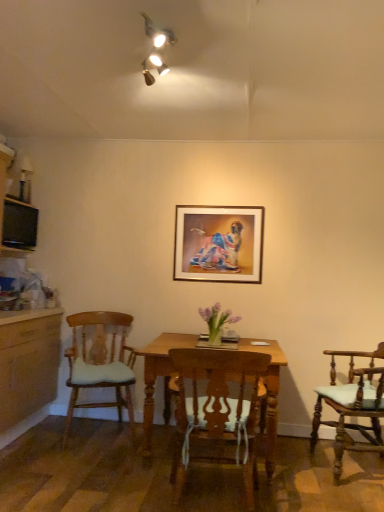
How much space does wooden chair with cushion at right, acting as the third chair starting from the left, occupy horizontally?

It is 58.50 centimeters.

Identify the location of wooden chair with cushion at right, acting as the third chair starting from the left. This screenshot has width=384, height=512. pyautogui.click(x=352, y=405).

Is black glossy television at left a part of wooden chair with cushion at left, placed as the 1th chair when sorted from left to right?

No, black glossy television at left is located outside of wooden chair with cushion at left, placed as the 1th chair when sorted from left to right.

Which object is closer to the camera, wooden chair with cushion at left, placed as the 1th chair when sorted from left to right, or black glossy television at left?

wooden chair with cushion at left, placed as the 1th chair when sorted from left to right, is in front.

Considering the sizes of objects wooden chair with cushion at left, placed as the 1th chair when sorted from left to right, and black glossy television at left in the image provided, who is thinner, wooden chair with cushion at left, placed as the 1th chair when sorted from left to right, or black glossy television at left?

With smaller width is black glossy television at left.

How far apart are wooden chair with cushion at left, arranged as the third chair when viewed from the right, and black glossy television at left?

wooden chair with cushion at left, arranged as the third chair when viewed from the right, is 1.07 meters away from black glossy television at left.

From their relative heights in the image, would you say wooden chair at center, the second chair from the left, is taller or shorter than wooden chair with cushion at left, arranged as the third chair when viewed from the right?

In the image, wooden chair at center, the second chair from the left, appears to be shorter than wooden chair with cushion at left, arranged as the third chair when viewed from the right.

Considering the positions of point (242, 461) and point (110, 353), is point (242, 461) closer or farther from the camera than point (110, 353)?

Point (242, 461).

Who is bigger, wooden chair at center, the second chair from the left, or wooden chair with cushion at left, placed as the 1th chair when sorted from left to right?

wooden chair with cushion at left, placed as the 1th chair when sorted from left to right, is bigger.

From the image's perspective, which object appears higher, wooden chair at center, the second chair from the left, or wooden chair with cushion at left, arranged as the third chair when viewed from the right?

From the image's view, wooden chair with cushion at left, arranged as the third chair when viewed from the right, is above.

Does gold-framed picture at center have a lesser height compared to black glossy television at left?

No, gold-framed picture at center is not shorter than black glossy television at left.

Where is `picture frame located on the right of black glossy television at left`? picture frame located on the right of black glossy television at left is located at coordinates (218, 244).

Which is in front, point (234, 210) or point (25, 230)?

The point (234, 210) is closer to the camera.

Is wooden chair at center, positioned as the second chair in right-to-left order, beside black glossy television at left?

There is a gap between wooden chair at center, positioned as the second chair in right-to-left order, and black glossy television at left.

From the image's perspective, is wooden chair at center, the second chair from the left, on black glossy television at left?

No.

Is wooden chair at center, the second chair from the left, outside of black glossy television at left?

Yes, wooden chair at center, the second chair from the left, is outside of black glossy television at left.

Which object is positioned more to the right, wooden chair with cushion at left, arranged as the third chair when viewed from the right, or wooden chair at center, positioned as the second chair in right-to-left order?

wooden chair at center, positioned as the second chair in right-to-left order, is more to the right.

Can you confirm if wooden chair with cushion at left, arranged as the third chair when viewed from the right, is taller than wooden chair at center, positioned as the second chair in right-to-left order?

Correct, wooden chair with cushion at left, arranged as the third chair when viewed from the right, is much taller as wooden chair at center, positioned as the second chair in right-to-left order.

In the scene shown: Which object is further away from the camera, wooden chair with cushion at left, placed as the 1th chair when sorted from left to right, or wooden chair at center, positioned as the second chair in right-to-left order?

wooden chair with cushion at left, placed as the 1th chair when sorted from left to right, is behind.

Is wooden chair at center, positioned as the second chair in right-to-left order, located within wooden chair with cushion at left, arranged as the third chair when viewed from the right?

Definitely not — wooden chair at center, positioned as the second chair in right-to-left order, is not inside wooden chair with cushion at left, arranged as the third chair when viewed from the right.

Looking at this image, considering the sizes of gold-framed picture at center and wooden chair at center, the second chair from the left, in the image, is gold-framed picture at center wider or thinner than wooden chair at center, the second chair from the left,?

Clearly, gold-framed picture at center has less width compared to wooden chair at center, the second chair from the left.

Is gold-framed picture at center oriented towards wooden chair at center, the second chair from the left?

No.

Is the surface of gold-framed picture at center in direct contact with wooden chair at center, positioned as the second chair in right-to-left order?

No, gold-framed picture at center is not with wooden chair at center, positioned as the second chair in right-to-left order.

Between gold-framed picture at center and wooden chair at center, the second chair from the left, which one is positioned in front?

Positioned in front is wooden chair at center, the second chair from the left.

Could wooden chair with cushion at right, acting as the third chair starting from the left, be considered to be inside wooden chair at center, positioned as the second chair in right-to-left order?

No.

Is wooden chair at center, positioned as the second chair in right-to-left order, turned away from wooden chair with cushion at right, which is the 1th chair from right to left?

No.

Looking at this image, from a real-world perspective, which object rests below the other?

wooden chair with cushion at right, which is the 1th chair from right to left, from a real-world perspective.

From a real-world perspective, starting from the wooden chair with cushion at right, which is the 1th chair from right to left, which chair is the 1st one vertically above it? Please provide its 2D coordinates.

[(218, 409)]

From the image's perspective, starting from the black glossy television at left, which chair is the 1st one below? Please provide its 2D coordinates.

[(100, 362)]

Where is `chair above the wooden chair at center, positioned as the second chair in right-to-left order (from the image's perspective)`? This screenshot has height=512, width=384. chair above the wooden chair at center, positioned as the second chair in right-to-left order (from the image's perspective) is located at coordinates (100, 362).

Based on the photo, from the image, which object appears to be farther from wooden chair at center, positioned as the second chair in right-to-left order, black glossy television at left or wooden chair with cushion at left, placed as the 1th chair when sorted from left to right?

black glossy television at left.

When comparing their distances from wooden chair with cushion at right, which is the 1th chair from right to left, does wooden chair at center, the second chair from the left, or gold-framed picture at center seem closer?

wooden chair at center, the second chair from the left, lies closer to wooden chair with cushion at right, which is the 1th chair from right to left, than the other object.

Estimate the real-world distances between objects in this image. Which object is closer to black glossy television at left, gold-framed picture at center or wooden chair with cushion at right, acting as the third chair starting from the left?

Based on the image, gold-framed picture at center appears to be nearer to black glossy television at left.

Looking at this image, estimate the real-world distances between objects in this image. Which object is further from wooden chair with cushion at right, acting as the third chair starting from the left, wooden chair at center, positioned as the second chair in right-to-left order, or black glossy television at left?

black glossy television at left is positioned further to the anchor wooden chair with cushion at right, acting as the third chair starting from the left.

When comparing their distances from wooden chair at center, the second chair from the left, does wooden chair with cushion at left, placed as the 1th chair when sorted from left to right, or wooden chair with cushion at right, which is the 1th chair from right to left, seem closer?

Based on the image, wooden chair with cushion at right, which is the 1th chair from right to left, appears to be nearer to wooden chair at center, the second chair from the left.

Based on their spatial positions, is black glossy television at left or wooden chair at center, the second chair from the left, closer to gold-framed picture at center?

Based on the image, wooden chair at center, the second chair from the left, appears to be nearer to gold-framed picture at center.

In the scene shown: Based on their spatial positions, is wooden chair at center, positioned as the second chair in right-to-left order, or wooden chair with cushion at right, acting as the third chair starting from the left, closer to gold-framed picture at center?

Among the two, wooden chair with cushion at right, acting as the third chair starting from the left, is located nearer to gold-framed picture at center.

Estimate the real-world distances between objects in this image. Which object is closer to black glossy television at left, wooden chair with cushion at right, acting as the third chair starting from the left, or wooden chair with cushion at left, placed as the 1th chair when sorted from left to right?

Based on the image, wooden chair with cushion at left, placed as the 1th chair when sorted from left to right, appears to be nearer to black glossy television at left.

The image size is (384, 512). I want to click on picture frame between wooden chair with cushion at left, arranged as the third chair when viewed from the right, and wooden chair with cushion at right, which is the 1th chair from right to left, in the horizontal direction, so click(x=218, y=244).

This screenshot has width=384, height=512. In order to click on picture frame between black glossy television at left and wooden chair with cushion at right, which is the 1th chair from right to left, in the horizontal direction in this screenshot , I will do `click(218, 244)`.

Identify the location of chair situated between wooden chair with cushion at left, placed as the 1th chair when sorted from left to right, and wooden chair with cushion at right, which is the 1th chair from right to left, from left to right. (218, 409).

This screenshot has height=512, width=384. Find the location of `chair between black glossy television at left and wooden chair at center, the second chair from the left, from left to right`. chair between black glossy television at left and wooden chair at center, the second chair from the left, from left to right is located at coordinates (100, 362).